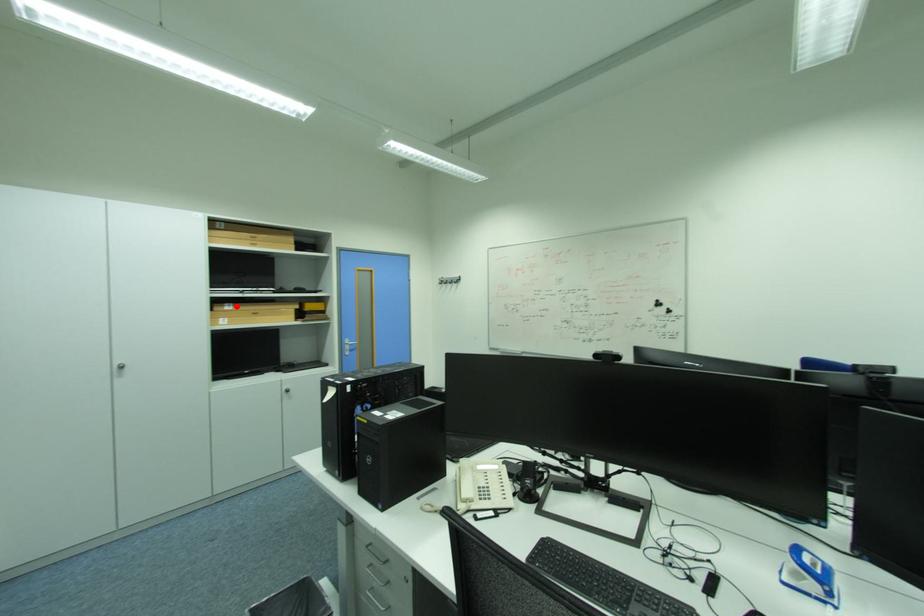
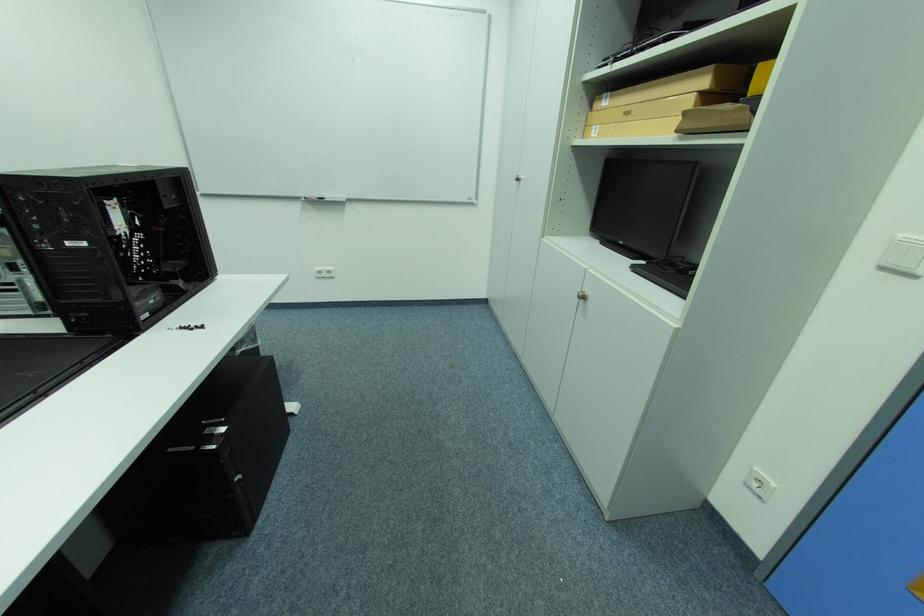
The point at the highlighted location is marked in the first image. Where is the corresponding point in the second image?

(614, 98)